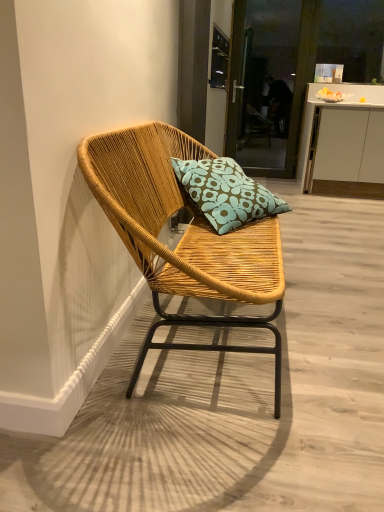
Where is `woven wood chair at center`? woven wood chair at center is located at coordinates (182, 238).

The width and height of the screenshot is (384, 512). Identify the location of white matte cabinet at center. (343, 143).

Where is `woven wood chair at center`? The height and width of the screenshot is (512, 384). woven wood chair at center is located at coordinates (182, 238).

At what (x,y) coordinates should I click in order to perform the action: click on cabinetry below the teal floral cushion at center (from a real-world perspective). Please return your answer as a coordinate pair (x, y). Looking at the image, I should click on pyautogui.click(x=343, y=143).

Is point (304, 170) less distant than point (218, 185)?

No, it is behind (218, 185).

From a real-world perspective, which object stands above the other?

teal floral cushion at center.

How many degrees apart are the facing directions of white matte cabinet at center and teal floral cushion at center?

The facing directions of white matte cabinet at center and teal floral cushion at center are 51 degrees apart.

Does teal floral cushion at center have a greater height compared to woven wood chair at center?

No.

Is teal floral cushion at center far away from woven wood chair at center?

No, teal floral cushion at center is not far from woven wood chair at center.

From the image's perspective, is teal floral cushion at center located beneath woven wood chair at center?

Actually, teal floral cushion at center appears above woven wood chair at center in the image.

Is teal floral cushion at center smaller than woven wood chair at center?

Indeed, teal floral cushion at center has a smaller size compared to woven wood chair at center.

Between white matte cabinet at center and transparent glass screen door at upper center, which one appears on the right side from the viewer's perspective?

white matte cabinet at center is more to the right.

Is white matte cabinet at center not near transparent glass screen door at upper center?

Yes, white matte cabinet at center and transparent glass screen door at upper center are located far from each other.

In terms of size, does white matte cabinet at center appear bigger or smaller than transparent glass screen door at upper center?

Considering their sizes, white matte cabinet at center takes up more space than transparent glass screen door at upper center.

Is white matte cabinet at center closer to the viewer compared to transparent glass screen door at upper center?

Yes.

Considering the sizes of objects teal floral cushion at center and transparent glass screen door at upper center in the image provided, who is smaller, teal floral cushion at center or transparent glass screen door at upper center?

With smaller size is teal floral cushion at center.

Is teal floral cushion at center oriented towards transparent glass screen door at upper center?

No, teal floral cushion at center does not turn towards transparent glass screen door at upper center.

From a real-world perspective, is teal floral cushion at center located beneath transparent glass screen door at upper center?

Correct, in the physical world, teal floral cushion at center is lower than transparent glass screen door at upper center.

From the image's perspective, relative to white matte cabinet at center, is woven wood chair at center above or below?

woven wood chair at center is situated lower than white matte cabinet at center in the image.

Choose the correct answer: Is woven wood chair at center inside white matte cabinet at center or outside it?

The correct answer is: outside.

Does woven wood chair at center have a lesser width compared to white matte cabinet at center?

In fact, woven wood chair at center might be wider than white matte cabinet at center.

Is woven wood chair at center not near white matte cabinet at center?

Yes, woven wood chair at center and white matte cabinet at center are located far from each other.

From the image's perspective, is white matte cabinet at center located beneath woven wood chair at center?

No, from the image's perspective, white matte cabinet at center is not beneath woven wood chair at center.

Would you say white matte cabinet at center is a long distance from woven wood chair at center?

Indeed, white matte cabinet at center is not near woven wood chair at center.

Is white matte cabinet at center completely or partially outside of woven wood chair at center?

Yes, white matte cabinet at center is located beyond the bounds of woven wood chair at center.

Does white matte cabinet at center have a lesser width compared to woven wood chair at center?

Indeed, white matte cabinet at center has a lesser width compared to woven wood chair at center.

Can you confirm if teal floral cushion at center is thinner than white matte cabinet at center?

Yes, teal floral cushion at center is thinner than white matte cabinet at center.

Can you tell me how much teal floral cushion at center and white matte cabinet at center differ in facing direction?

teal floral cushion at center and white matte cabinet at center are facing 51 degrees away from each other.

Locate an element on the screen. cabinetry on the right side of teal floral cushion at center is located at coordinates (343, 143).

From the image's perspective, is teal floral cushion at center located above or below white matte cabinet at center?

teal floral cushion at center is situated lower than white matte cabinet at center in the image.

In order to click on pillow that is below the white matte cabinet at center (from the image's perspective) in this screenshot , I will do `click(225, 193)`.

Locate an element on the screen. pillow above the woven wood chair at center (from a real-world perspective) is located at coordinates (225, 193).

Based on their spatial positions, is transparent glass screen door at upper center or woven wood chair at center further from teal floral cushion at center?

transparent glass screen door at upper center is positioned further to the anchor teal floral cushion at center.

When comparing their distances from white matte cabinet at center, does transparent glass screen door at upper center or woven wood chair at center seem further?

Based on the image, woven wood chair at center appears to be further to white matte cabinet at center.

Based on their spatial positions, is white matte cabinet at center or teal floral cushion at center closer to woven wood chair at center?

teal floral cushion at center.

Based on their spatial positions, is white matte cabinet at center or woven wood chair at center closer to teal floral cushion at center?

woven wood chair at center.

Consider the image. Estimate the real-world distances between objects in this image. Which object is further from white matte cabinet at center, teal floral cushion at center or transparent glass screen door at upper center?

teal floral cushion at center is further to white matte cabinet at center.

Which object lies nearer to the anchor point transparent glass screen door at upper center, white matte cabinet at center or teal floral cushion at center?

white matte cabinet at center is closer to transparent glass screen door at upper center.

Looking at the image, which one is located closer to white matte cabinet at center, transparent glass screen door at upper center or teal floral cushion at center?

Among the two, transparent glass screen door at upper center is located nearer to white matte cabinet at center.

Estimate the real-world distances between objects in this image. Which object is closer to teal floral cushion at center, woven wood chair at center or transparent glass screen door at upper center?

woven wood chair at center is positioned closer to the anchor teal floral cushion at center.

At what (x,y) coordinates should I click in order to perform the action: click on pillow between woven wood chair at center and transparent glass screen door at upper center in the front-back direction. Please return your answer as a coordinate pair (x, y). The width and height of the screenshot is (384, 512). Looking at the image, I should click on (225, 193).

This screenshot has width=384, height=512. Identify the location of cabinetry between woven wood chair at center and transparent glass screen door at upper center from front to back. (343, 143).

Identify the location of cabinetry located between teal floral cushion at center and transparent glass screen door at upper center in the depth direction. This screenshot has width=384, height=512. (343, 143).

This screenshot has height=512, width=384. I want to click on pillow located between woven wood chair at center and white matte cabinet at center in the depth direction, so click(x=225, y=193).